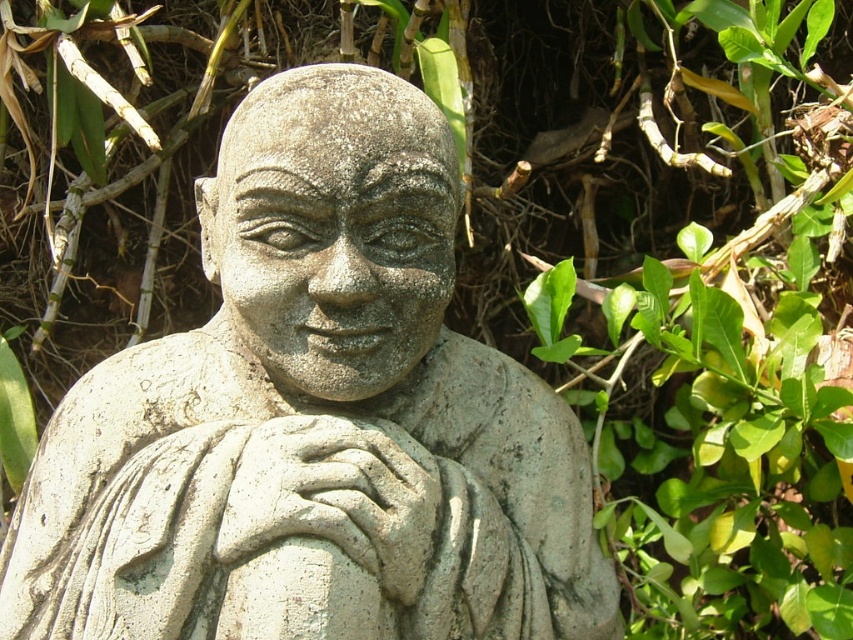
Between gray stone statue at center and gray stone hand at center, which one appears on the left side from the viewer's perspective?

Positioned to the left is gray stone hand at center.

Does gray stone statue at center have a lesser width compared to gray stone hand at center?

Incorrect, gray stone statue at center's width is not less than gray stone hand at center's.

Is point (229, 259) farther from camera compared to point (389, 432)?

Yes, point (229, 259) is behind point (389, 432).

Locate an element on the screen. Image resolution: width=853 pixels, height=640 pixels. gray stone statue at center is located at coordinates (314, 412).